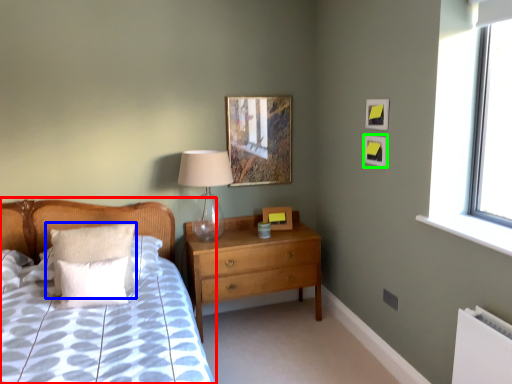
Question: Which object is positioned farthest from bed (highlighted by a red box)? Select from pillow (highlighted by a blue box) and picture frame (highlighted by a green box).

Choices:
 (A) pillow
 (B) picture frame

Answer: (B)